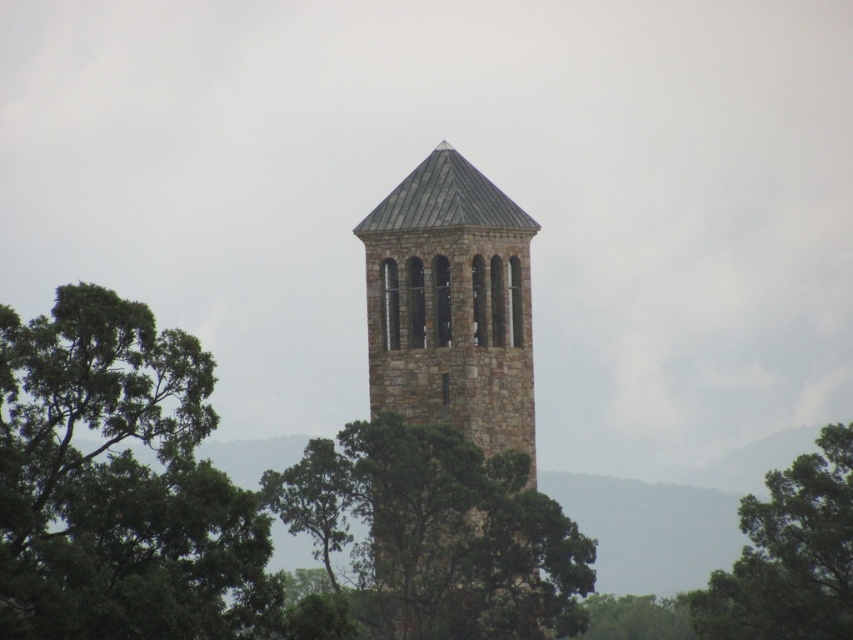
Question: Is green leafy tree at upper center behind green leafy tree at lower center?

Choices:
 (A) yes
 (B) no

Answer: (A)

Question: Estimate the real-world distances between objects in this image. Which object is closer to the green leafy tree at center?

Choices:
 (A) stone textured tower at center
 (B) green leafy tree at left
 (C) green leafy tree at upper center

Answer: (A)

Question: In this image, where is green leafy tree at left located relative to green leafy tree at center?

Choices:
 (A) right
 (B) left

Answer: (B)

Question: Is stone textured tower at center below green leafy tree at lower center?

Choices:
 (A) yes
 (B) no

Answer: (B)

Question: Which point appears farthest from the camera in this image?

Choices:
 (A) (791, 486)
 (B) (660, 632)
 (C) (231, 531)
 (D) (334, 476)

Answer: (B)

Question: Which is nearer to the green leafy tree at lower center?

Choices:
 (A) stone textured tower at center
 (B) green leafy tree at center
 (C) green leafy tree at upper center
 (D) green leafy tree at left

Answer: (B)